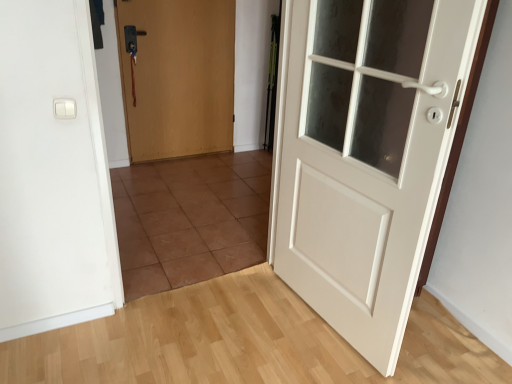
What is the approximate height of white matte door at right, arranged as the second door when viewed from the back?

It is 4.66 feet.

Where is `brown tile at center`? This screenshot has height=384, width=512. brown tile at center is located at coordinates (190, 219).

Is wooden door at center, the 2th door positioned from the right, bigger or smaller than white plastic light switch at upper left?

In the image, wooden door at center, the 2th door positioned from the right, appears to be larger than white plastic light switch at upper left.

Is wooden door at center, the 2th door positioned from the right, inside or outside of white plastic light switch at upper left?

wooden door at center, the 2th door positioned from the right, is outside white plastic light switch at upper left.

In the scene shown: Is white plastic light switch at upper left at the back of wooden door at center, the second door from the front?

No, wooden door at center, the second door from the front, is not facing the opposite direction of white plastic light switch at upper left.

Does wooden door at center, the 2th door positioned from the right, have a lesser width compared to white plastic light switch at upper left?

In fact, wooden door at center, the 2th door positioned from the right, might be wider than white plastic light switch at upper left.

Is brown tile at center in contact with wooden door at center, positioned as the 1th door in back-to-front order?

brown tile at center and wooden door at center, positioned as the 1th door in back-to-front order, are clearly separated.

Between brown tile at center and wooden door at center, positioned as the 1th door in back-to-front order, which one appears on the right side from the viewer's perspective?

Positioned to the right is brown tile at center.

Can we say brown tile at center lies outside wooden door at center, positioned as the 1th door in back-to-front order?

That's correct, brown tile at center is outside of wooden door at center, positioned as the 1th door in back-to-front order.

From the image's perspective, which is below, brown tile at center or wooden door at center, the second door from the front?

From the image's view, brown tile at center is below.

In the scene shown: Is brown tile at center not near white plastic light switch at upper left?

Yes.

Based on the photo, could you tell me if brown tile at center is facing white plastic light switch at upper left?

No, brown tile at center is not turned towards white plastic light switch at upper left.

Which point is more distant from viewer, (x=156, y=161) or (x=73, y=118)?

The point (x=156, y=161) is behind.

Is brown tile at center outside of white plastic light switch at upper left?

Yes.

Can you confirm if wooden door at center, the first door viewed from the left, is positioned to the right of white matte door at right, which is the 1th door from right to left?

Incorrect, wooden door at center, the first door viewed from the left, is not on the right side of white matte door at right, which is the 1th door from right to left.

From the image's perspective, is wooden door at center, the first door viewed from the left, located above or below white matte door at right, arranged as the second door when viewed from the back?

Clearly, from the image's perspective, wooden door at center, the first door viewed from the left, is above white matte door at right, arranged as the second door when viewed from the back.

From a real-world perspective, is wooden door at center, the first door viewed from the left, above or below white matte door at right, which is the 1th door from right to left?

Clearly, from a real-world perspective, wooden door at center, the first door viewed from the left, is below white matte door at right, which is the 1th door from right to left.

In the scene shown: From a real-world perspective, which object rests below the other?

white matte door at right, which is the 1th door from right to left, is physically lower.

Find the location of a particular element. The width and height of the screenshot is (512, 384). door that is the 1st object directly below the white plastic light switch at upper left (from a real-world perspective) is located at coordinates (365, 155).

What's the angular difference between white matte door at right, the 2th door when ordered from left to right, and white plastic light switch at upper left's facing directions?

They differ by 83 degrees in their facing directions.

Between white matte door at right, which ranks as the 1th door in front-to-back order, and white plastic light switch at upper left, which one has larger size?

white matte door at right, which ranks as the 1th door in front-to-back order, is bigger.

Which object is more forward, white plastic light switch at upper left or white matte door at right, which ranks as the 1th door in front-to-back order?

white matte door at right, which ranks as the 1th door in front-to-back order.

Is white plastic light switch at upper left smaller than white matte door at right, which ranks as the 1th door in front-to-back order?

Correct, white plastic light switch at upper left occupies less space than white matte door at right, which ranks as the 1th door in front-to-back order.

Is white plastic light switch at upper left directly adjacent to white matte door at right, which is the 1th door from right to left?

No, white plastic light switch at upper left is not making contact with white matte door at right, which is the 1th door from right to left.

Which is behind, wooden door at center, the second door from the front, or brown tile at center?

wooden door at center, the second door from the front, is further away from the camera.

Find the location of a particular element. tile that appears below the wooden door at center, the 2th door positioned from the right (from a real-world perspective) is located at coordinates (190, 219).

Could you tell me if wooden door at center, the second door from the front, is facing brown tile at center?

Yes.

Is wooden door at center, the first door viewed from the left, taller or shorter than brown tile at center?

Clearly, wooden door at center, the first door viewed from the left, is taller compared to brown tile at center.

From a real-world perspective, which door is the 2nd one underneath the white plastic light switch at upper left? Please provide its 2D coordinates.

[(177, 76)]

You are a GUI agent. You are given a task and a screenshot of the screen. Output one action in this format:
    pyautogui.click(x=<x>, y=<y>)
    Task: Click on the tile below the wooden door at center, the 2th door positioned from the right (from the image's perspective)
    The width and height of the screenshot is (512, 384).
    Given the screenshot: What is the action you would take?
    pyautogui.click(x=190, y=219)

Based on their spatial positions, is white plastic light switch at upper left or white matte door at right, which is the 1th door from right to left, further from wooden door at center, positioned as the 1th door in back-to-front order?

Based on the image, white plastic light switch at upper left appears to be further to wooden door at center, positioned as the 1th door in back-to-front order.

Based on their spatial positions, is brown tile at center or white plastic light switch at upper left further from wooden door at center, positioned as the 1th door in back-to-front order?

white plastic light switch at upper left.

Estimate the real-world distances between objects in this image. Which object is closer to brown tile at center, wooden door at center, positioned as the 1th door in back-to-front order, or white matte door at right, the 2th door when ordered from left to right?

wooden door at center, positioned as the 1th door in back-to-front order.

Considering their positions, is white plastic light switch at upper left positioned further to wooden door at center, the 2th door positioned from the right, than brown tile at center?

Based on the image, white plastic light switch at upper left appears to be further to wooden door at center, the 2th door positioned from the right.

Which object lies further to the anchor point white plastic light switch at upper left, wooden door at center, the second door from the front, or brown tile at center?

wooden door at center, the second door from the front.

Which object lies further to the anchor point wooden door at center, the first door viewed from the left, white matte door at right, arranged as the second door when viewed from the back, or white plastic light switch at upper left?

white plastic light switch at upper left.

Consider the image. Looking at the image, which one is located further to white plastic light switch at upper left, white matte door at right, arranged as the second door when viewed from the back, or wooden door at center, the first door viewed from the left?

wooden door at center, the first door viewed from the left, is positioned further to the anchor white plastic light switch at upper left.

Estimate the real-world distances between objects in this image. Which object is further from white plastic light switch at upper left, white matte door at right, which is the 1th door from right to left, or brown tile at center?

The object further to white plastic light switch at upper left is brown tile at center.

Identify the location of light switch located between white matte door at right, the 2th door when ordered from left to right, and wooden door at center, the first door viewed from the left, in the depth direction. The image size is (512, 384). (64, 108).

Image resolution: width=512 pixels, height=384 pixels. Identify the location of tile between white plastic light switch at upper left and white matte door at right, arranged as the second door when viewed from the back. (190, 219).

Where is `tile between white plastic light switch at upper left and wooden door at center, the second door from the front, along the z-axis`? tile between white plastic light switch at upper left and wooden door at center, the second door from the front, along the z-axis is located at coordinates (190, 219).

Find the location of a particular element. The image size is (512, 384). tile located between white matte door at right, which ranks as the 1th door in front-to-back order, and wooden door at center, the 2th door positioned from the right, in the depth direction is located at coordinates (190, 219).